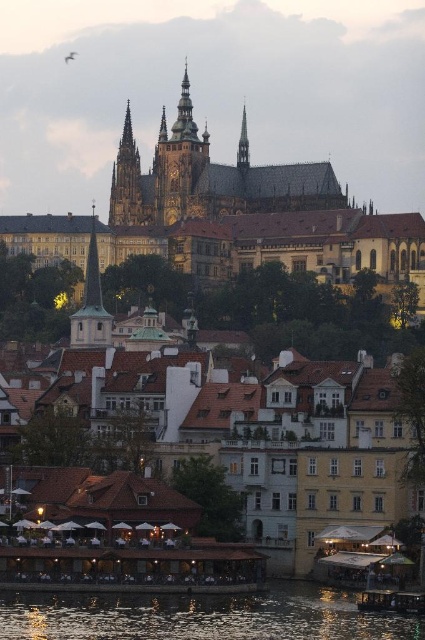
Question: Which object is positioned closest to the golden stone spire at upper center?

Choices:
 (A) golden stone castle at upper center
 (B) smooth gold spire at upper center
 (C) reflective glass water at lower center
 (D) golden ornate tower at center

Answer: (D)

Question: Does golden ornate tower at center come behind smooth gold spire at upper center?

Choices:
 (A) no
 (B) yes

Answer: (A)

Question: Which object is positioned farthest from the golden stone castle at upper center?

Choices:
 (A) golden ornate tower at center
 (B) golden stone spire at upper center
 (C) smooth gold spire at upper center

Answer: (C)

Question: Estimate the real-world distances between objects in this image. Which object is farther from the golden stone castle at upper center?

Choices:
 (A) golden ornate tower at center
 (B) reflective glass water at lower center
 (C) smooth white spire at left
 (D) golden stone spire at upper center

Answer: (B)

Question: Is golden stone castle at upper center further to camera compared to smooth white spire at left?

Choices:
 (A) yes
 (B) no

Answer: (A)

Question: Is golden ornate tower at center above smooth white spire at left?

Choices:
 (A) yes
 (B) no

Answer: (A)